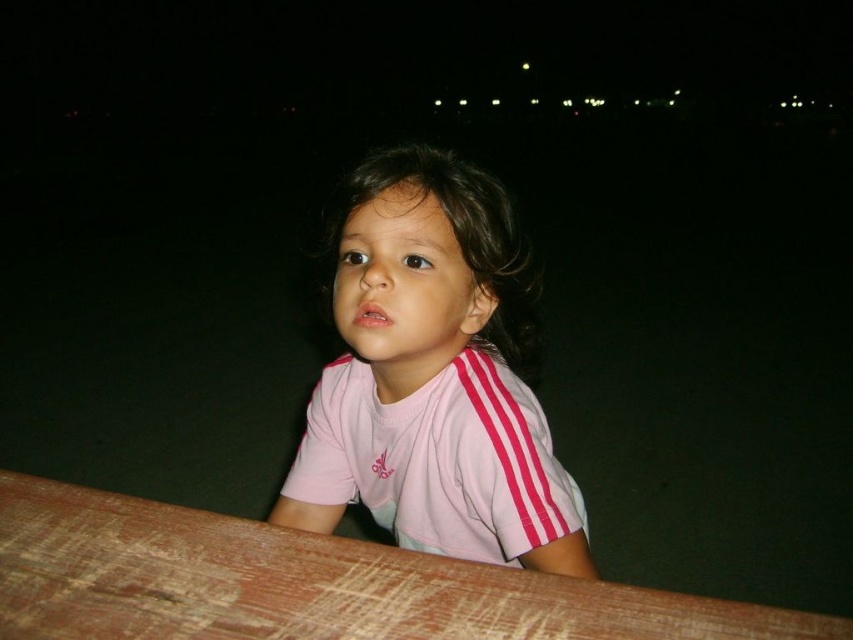
Question: Can you confirm if pink fabric shirt at center is thinner than brown wooden table at lower center?

Choices:
 (A) yes
 (B) no

Answer: (A)

Question: Is pink fabric shirt at center above brown wooden table at lower center?

Choices:
 (A) yes
 (B) no

Answer: (A)

Question: Considering the relative positions of pink fabric shirt at center and brown wooden table at lower center in the image provided, where is pink fabric shirt at center located with respect to brown wooden table at lower center?

Choices:
 (A) below
 (B) above

Answer: (B)

Question: Which object appears closest to the camera in this image?

Choices:
 (A) pink fabric shirt at center
 (B) brown wooden table at lower center

Answer: (B)

Question: Which object is farther from the camera taking this photo?

Choices:
 (A) pink fabric shirt at center
 (B) brown wooden table at lower center

Answer: (A)